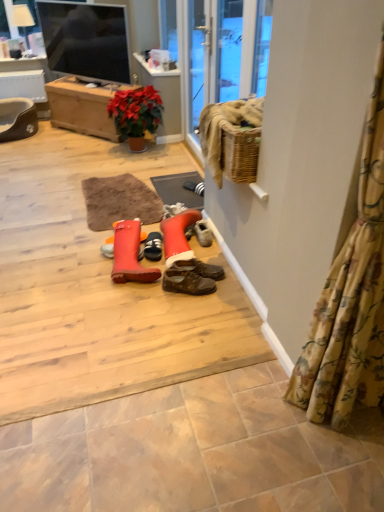
Image resolution: width=384 pixels, height=512 pixels. Find the location of `free space in front of brown leather shoes at center, the third footwear from the left`. free space in front of brown leather shoes at center, the third footwear from the left is located at coordinates (196, 303).